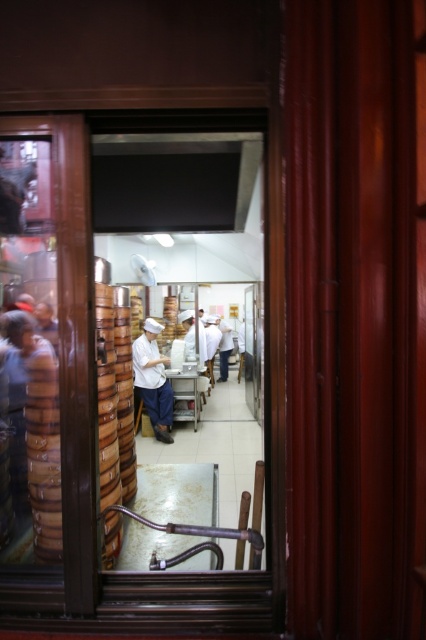
Can you confirm if transparent glass window at center is smaller than white uniform at center?

Yes, transparent glass window at center is smaller than white uniform at center.

Who is positioned more to the right, transparent glass window at center or white uniform at center?

Positioned to the right is transparent glass window at center.

Does point (229, 518) lie in front of point (154, 392)?

Yes, point (229, 518) is in front of point (154, 392).

Where is `transparent glass window at center`? This screenshot has height=640, width=426. transparent glass window at center is located at coordinates (143, 600).